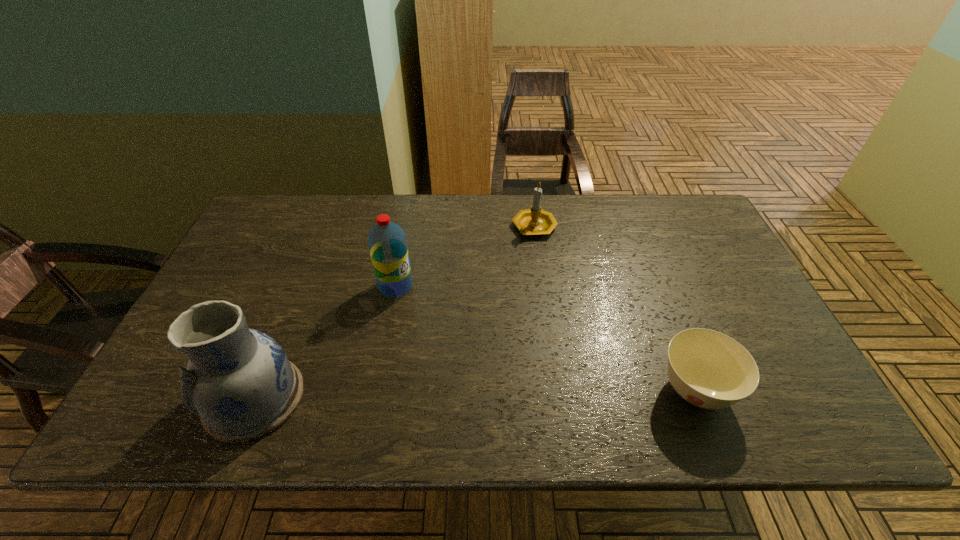
In order to click on the leftmost object in this screenshot , I will do `click(240, 382)`.

The width and height of the screenshot is (960, 540). Find the location of `the rightmost object`. the rightmost object is located at coordinates tap(708, 369).

You are a GUI agent. You are given a task and a screenshot of the screen. Output one action in this format:
    pyautogui.click(x=<x>, y=<y>)
    Task: Click on the sugar bowl
    This screenshot has width=960, height=540.
    Given the screenshot: What is the action you would take?
    pyautogui.click(x=708, y=369)

Image resolution: width=960 pixels, height=540 pixels. What are the coordinates of `candle holder` in the screenshot? It's located at (534, 221).

At what (x,y) coordinates should I click in order to perform the action: click on the farthest object. Please return your answer as a coordinate pair (x, y). Image resolution: width=960 pixels, height=540 pixels. Looking at the image, I should click on (534, 221).

Where is `water bottle`? This screenshot has height=540, width=960. water bottle is located at coordinates (387, 243).

Identify the location of the second object from left to right. This screenshot has height=540, width=960. (387, 243).

Identify the location of vacant space located 0.390m on the back of the pottery. The image size is (960, 540). (315, 249).

Identify the location of vacant space situated on the left of the sugar bowl. (565, 390).

I want to click on free space located 0.100m with a handle on the second shortest object, so click(x=529, y=265).